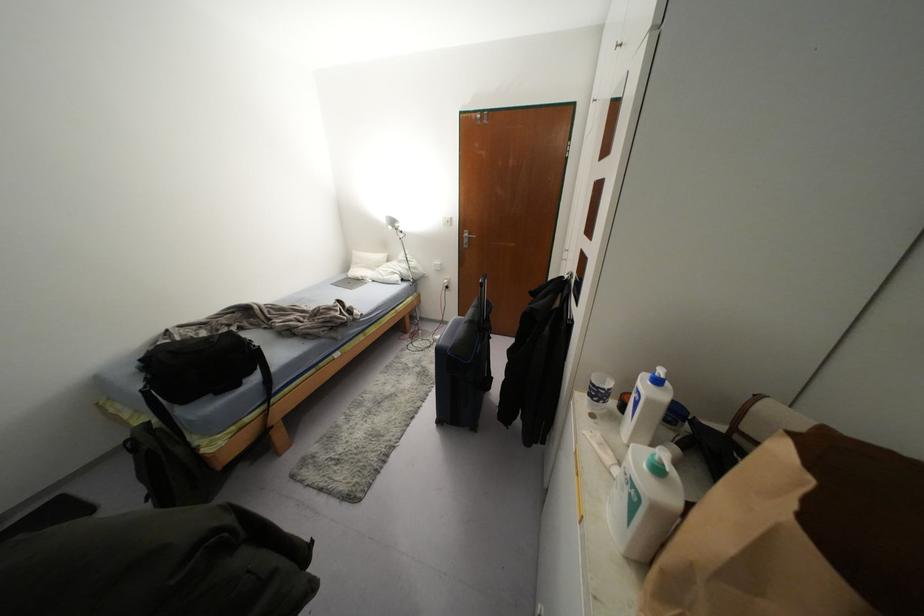
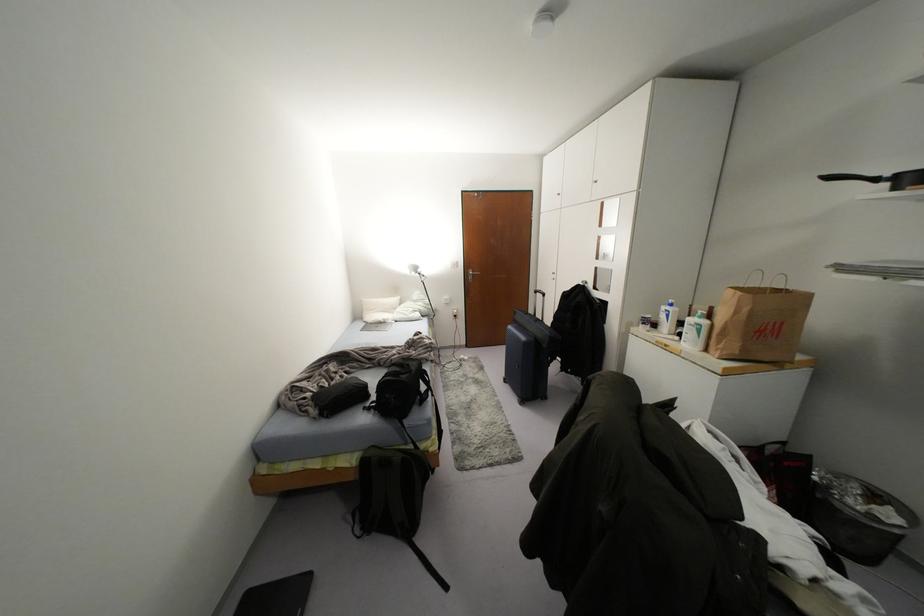
Where in the second image is the point corresponding to (x=382, y=256) from the first image?

(394, 299)